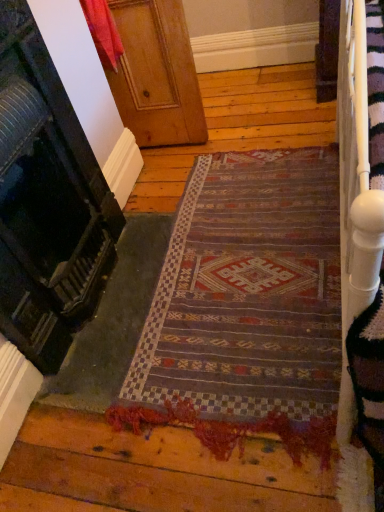
Identify the location of empty space that is ontop of textured woolen mat at center (from a real-world perspective). (243, 276).